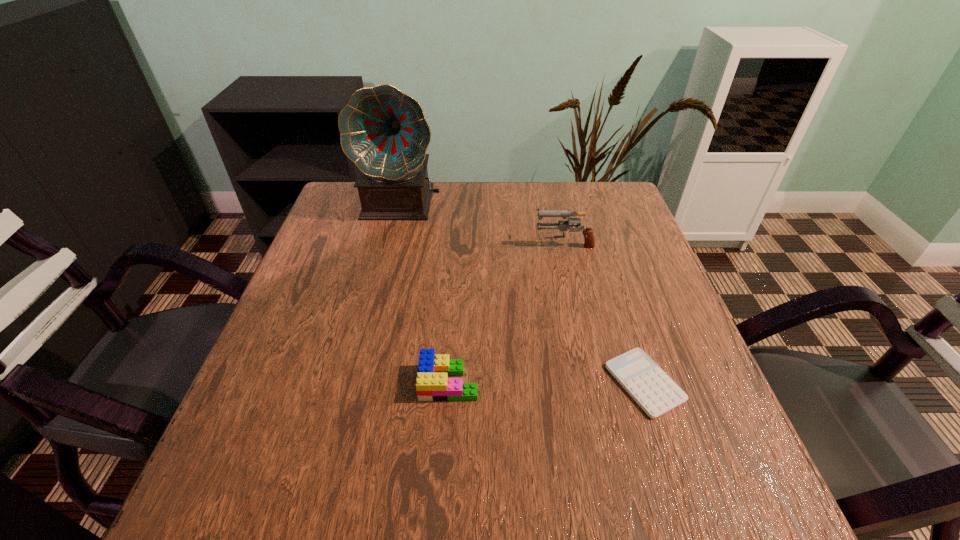
The width and height of the screenshot is (960, 540). In order to click on vacant area that lies between the shortest object and the Lego in this screenshot , I will do (x=546, y=382).

This screenshot has height=540, width=960. In order to click on unoccupied area between the calculator and the third object from right to left in this screenshot , I will do `click(546, 382)`.

Where is `free area in between the third shortest object and the second shortest object`? This screenshot has width=960, height=540. free area in between the third shortest object and the second shortest object is located at coordinates (506, 313).

This screenshot has height=540, width=960. What are the coordinates of `empty location between the shortest object and the gun` in the screenshot? It's located at (604, 313).

Identify the location of the third closest object to the gun. (x=432, y=384).

Identify which object is the second nearest to the shortest object. Please provide its 2D coordinates. Your answer should be formatted as a tuple, i.e. [(x, y)], where the tuple contains the x and y coordinates of a point satisfying the conditions above.

[(589, 239)]

I want to click on free space that satisfies the following two spatial constraints: 1. on the horn of the leftmost object; 2. on the left side of the shortest object, so click(x=360, y=383).

Find the location of a particular element. This screenshot has height=540, width=960. blank space that satisfies the following two spatial constraints: 1. on the horn of the calculator; 2. on the right side of the farthest object is located at coordinates (360, 383).

Find the location of a particular element. The image size is (960, 540). free location that satisfies the following two spatial constraints: 1. on the horn of the Lego; 2. on the right side of the record player is located at coordinates (360, 382).

The image size is (960, 540). Find the location of `vacant space that satisfies the following two spatial constraints: 1. on the front side of the second shortest object; 2. on the left side of the calculator`. vacant space that satisfies the following two spatial constraints: 1. on the front side of the second shortest object; 2. on the left side of the calculator is located at coordinates (449, 383).